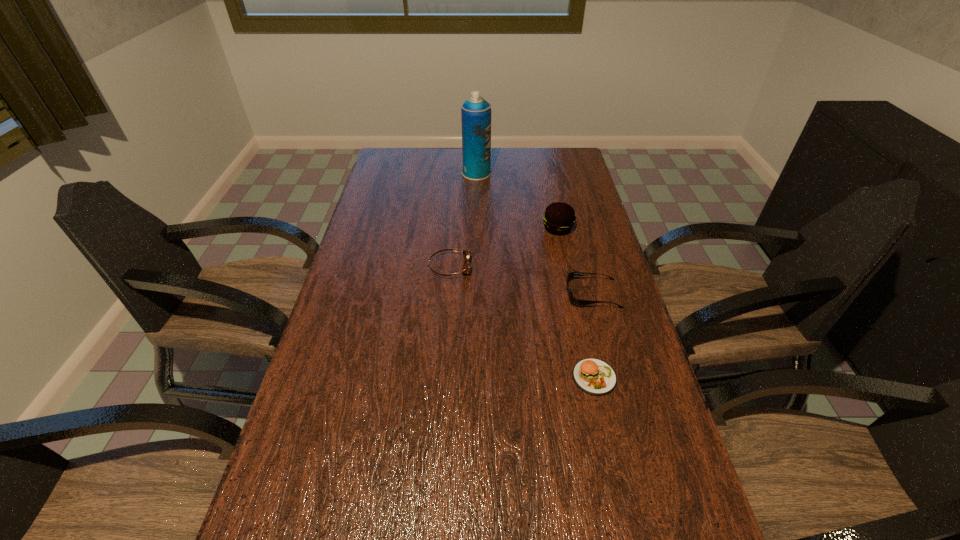
Find the location of a particular element. The height and width of the screenshot is (540, 960). vacant space located 0.080m through the lenses of the goggles is located at coordinates (496, 267).

Image resolution: width=960 pixels, height=540 pixels. I want to click on vacant region located on the front of the shorter patty, so click(612, 455).

This screenshot has height=540, width=960. I want to click on vacant point located on the front-facing side of the sunglasses, so click(517, 294).

Identify the location of free location located 0.390m on the front-facing side of the sunglasses. The width and height of the screenshot is (960, 540). (430, 294).

Where is `vacant area situated on the front-facing side of the sunglasses`? This screenshot has height=540, width=960. vacant area situated on the front-facing side of the sunglasses is located at coordinates (511, 294).

Identify the location of object situated at the far edge. The width and height of the screenshot is (960, 540). (475, 112).

Identify the location of sunglasses located at the right edge. (576, 302).

Where is `vacant space at the far edge of the desktop`? vacant space at the far edge of the desktop is located at coordinates (460, 176).

At what (x,y) coordinates should I click in order to perform the action: click on vacant space at the left edge of the desktop. Please return your answer as a coordinate pair (x, y). Image resolution: width=960 pixels, height=540 pixels. Looking at the image, I should click on [x=338, y=294].

Where is `free space at the right edge of the desktop`? This screenshot has width=960, height=540. free space at the right edge of the desktop is located at coordinates (562, 188).